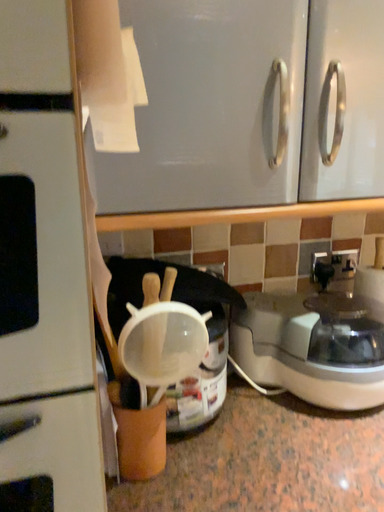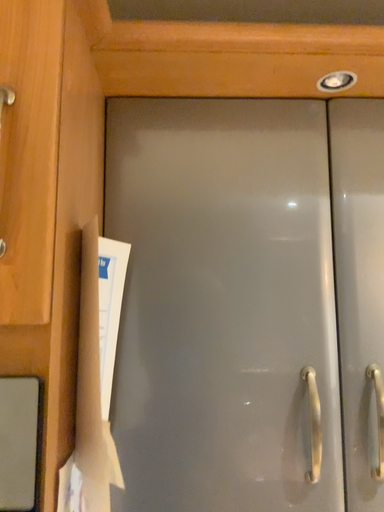
Question: Which way did the camera rotate in the video?

Choices:
 (A) rotated downward
 (B) rotated upward

Answer: (B)